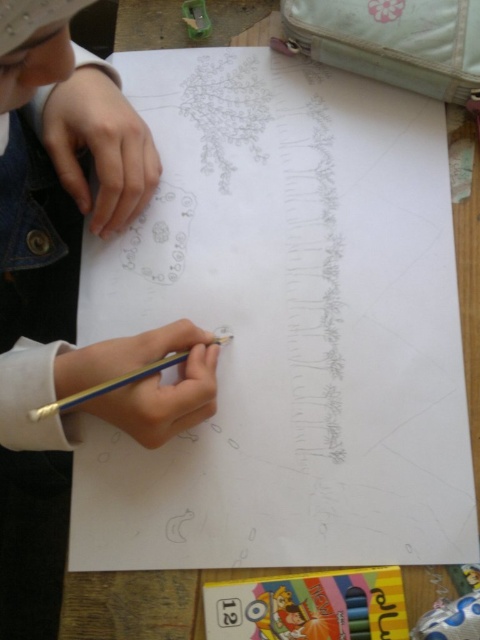
Based on the photo, you need to place a small eraser on the table so that it is between the pencil sketch paper at center and the metallic blue pencil at lower center. Based on their positions, where should you place the eraser?

The pencil sketch paper at center is above the metallic blue pencil at lower center, so placing the eraser between them would require positioning it below the pencil sketch paper at center and above the metallic blue pencil at lower center.

You are a teacher observing a child drawing. The child is using a pencil sketch paper at center and a metallic blue pencil at lower center. Which object is bigger in size?

The pencil sketch paper at center is larger in size than the metallic blue pencil at lower center according to the description.